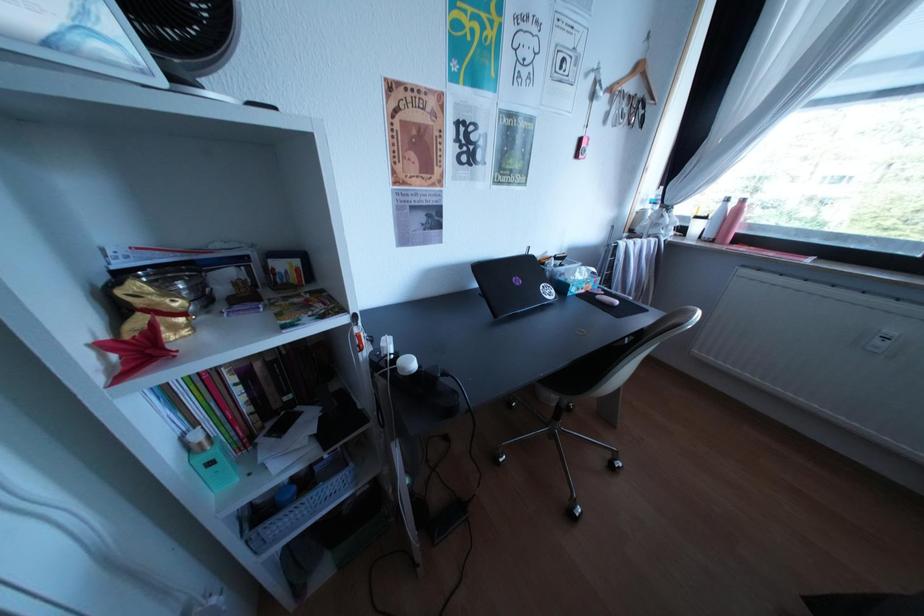
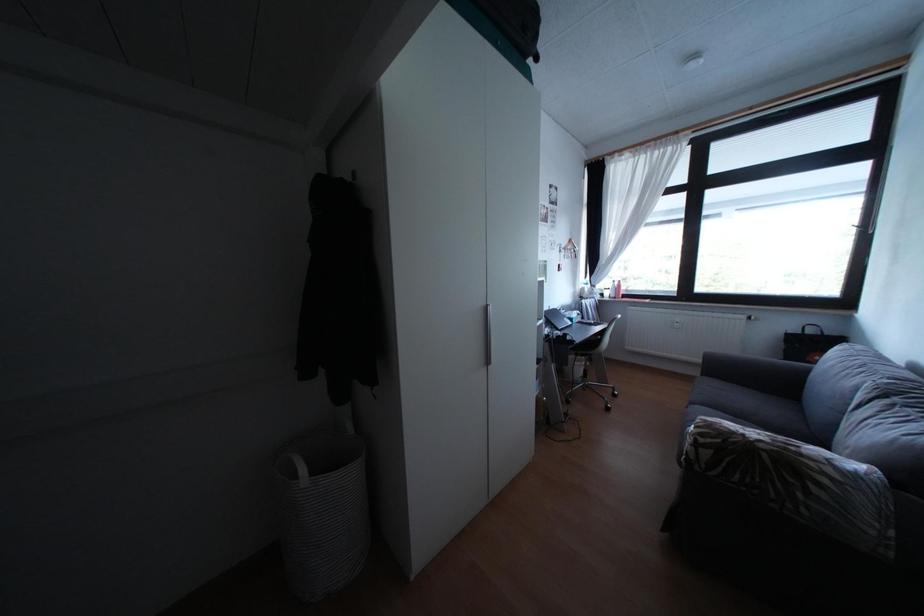
In a continuous first-person perspective shot, in which direction is the camera moving?

The movement direction of the cameraman is left, backward.